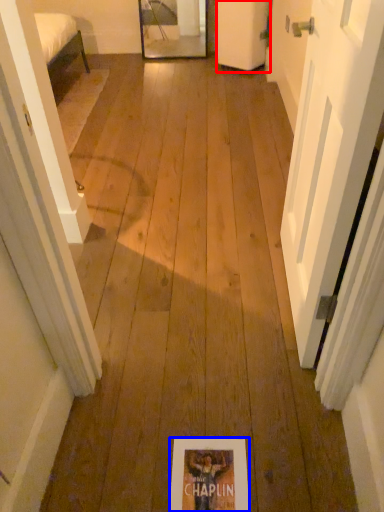
Question: Which point is further to the camera, door (highlighted by a red box) or flyer (highlighted by a blue box)?

Choices:
 (A) door
 (B) flyer

Answer: (A)